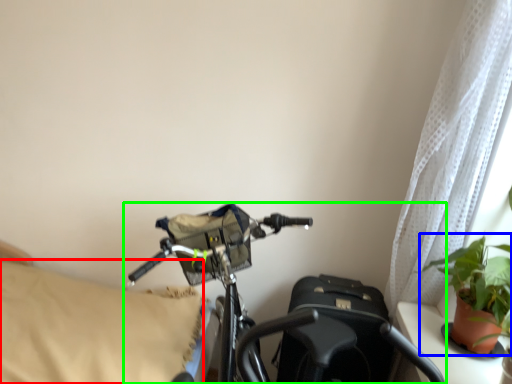
Question: Which is farther away from pillow (highlighted by a red box)? houseplant (highlighted by a blue box) or bicycle (highlighted by a green box)?

Choices:
 (A) houseplant
 (B) bicycle

Answer: (A)